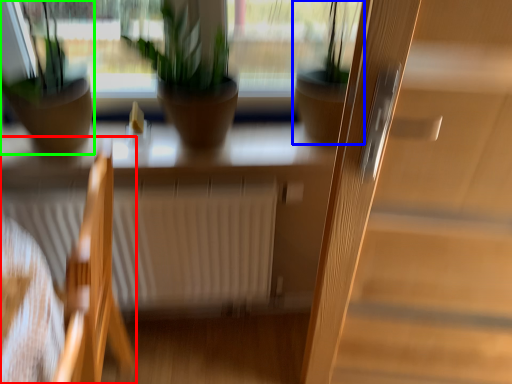
Question: Based on their relative distances, which object is nearer to chair (highlighted by a red box)? Choose from houseplant (highlighted by a blue box) and houseplant (highlighted by a green box).

Choices:
 (A) houseplant
 (B) houseplant

Answer: (B)